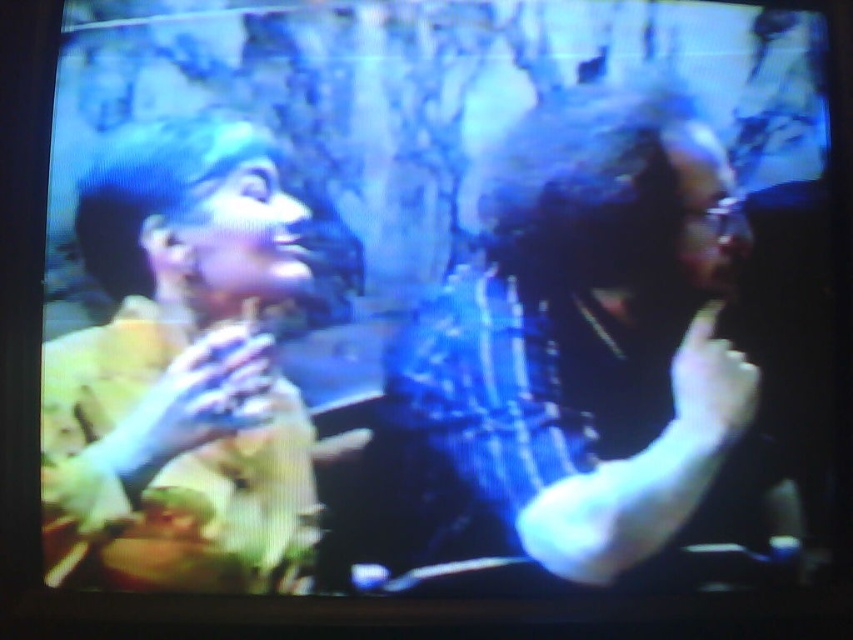
You are a photographer trying to capture a clear shot of both the matte black shirt at center and the yellow fabric at left. Given their positions and sizes, which one should you focus on first to ensure both are in frame?

The matte black shirt at center is taller than the yellow fabric at left, so you should focus on the matte black shirt at center first to ensure both are in frame.

You are at a party and want to grab a drink from the table between the matte black shirt at center and the yellow fabric at left. Can you fit your hand between them?

The matte black shirt at center is bigger than the yellow fabric at left, so there might not be enough space for your hand to fit between them.